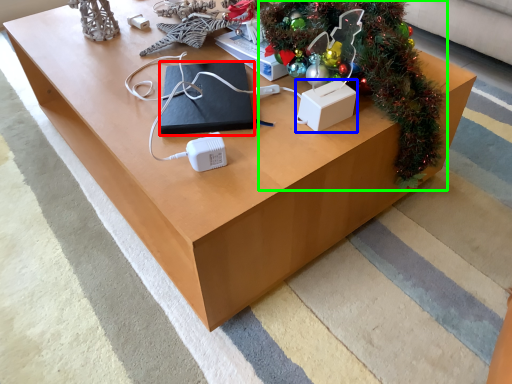
Question: Considering the real-world distances, which object is closest to pad (highlighted by a red box)? box (highlighted by a blue box) or christmas tree (highlighted by a green box).

Choices:
 (A) box
 (B) christmas tree

Answer: (A)